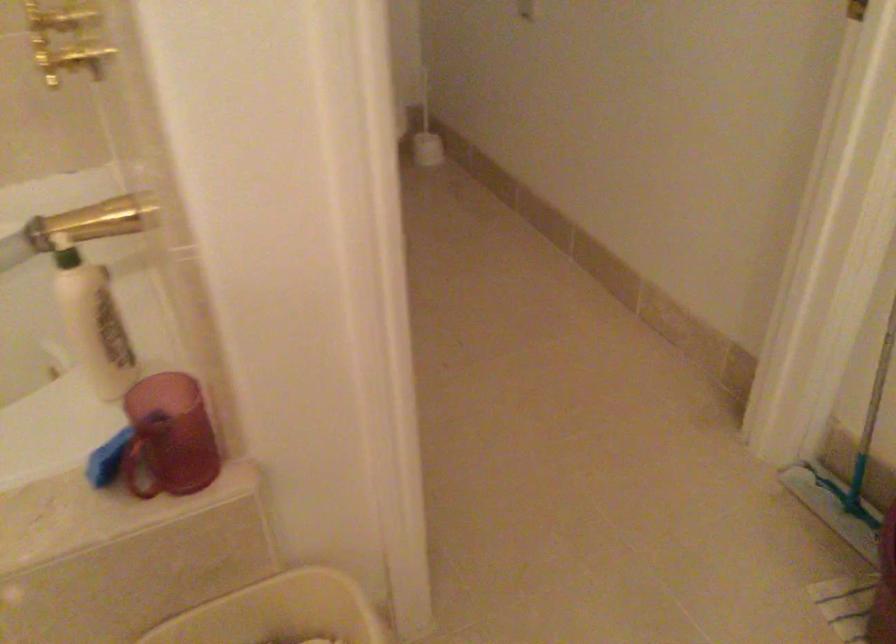
At what (x,y) coordinates should I click in order to perform the action: click on faucet diverter pin. Please return your answer as a coordinate pair (x, y). This screenshot has height=644, width=896. Looking at the image, I should click on (69, 61).